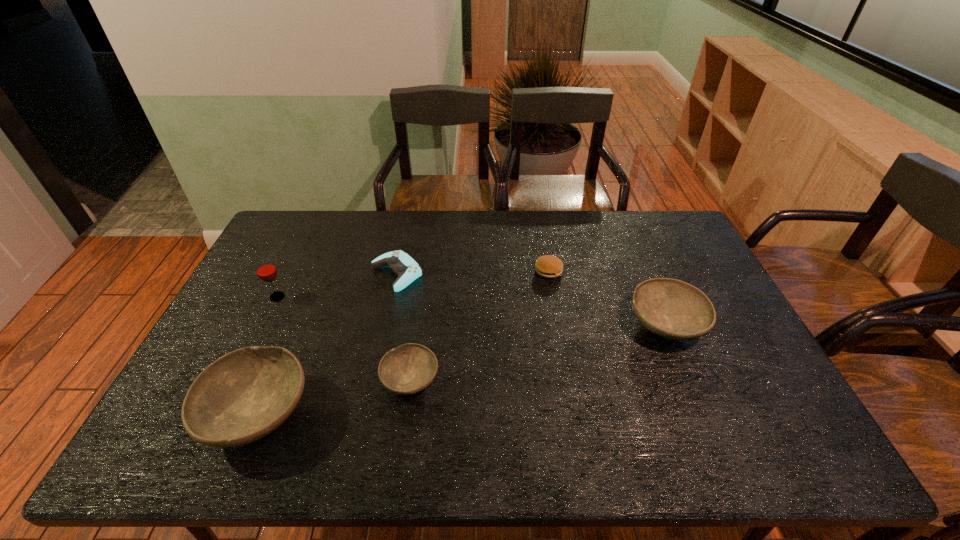
To achieve even spacing by inserting another bowl among them, please point to a vacant spot for this new bowl. Please provide its 2D coordinates. Your answer should be formatted as a tuple, i.e. [(x, y)], where the tuple contains the x and y coordinates of a point satisfying the conditions above.

[(545, 350)]